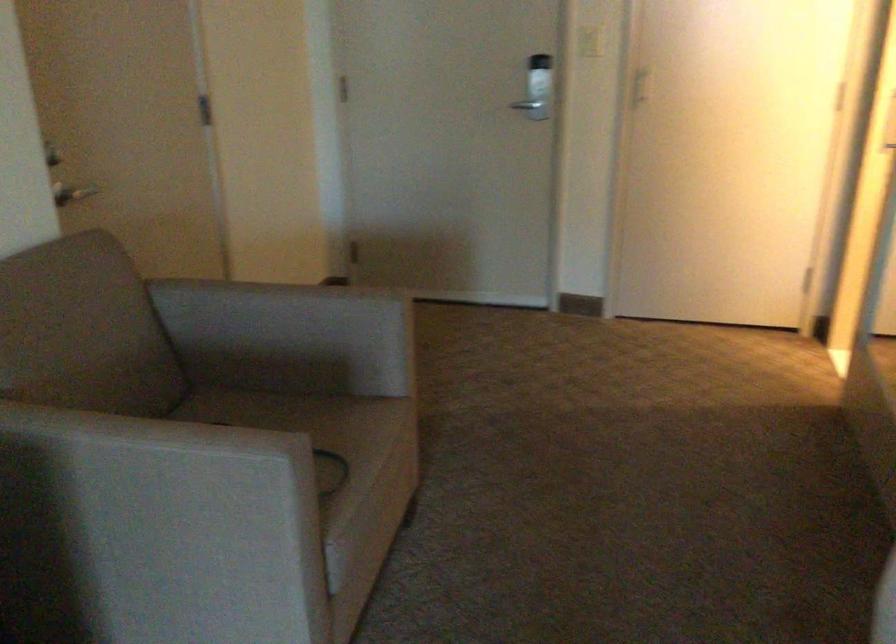
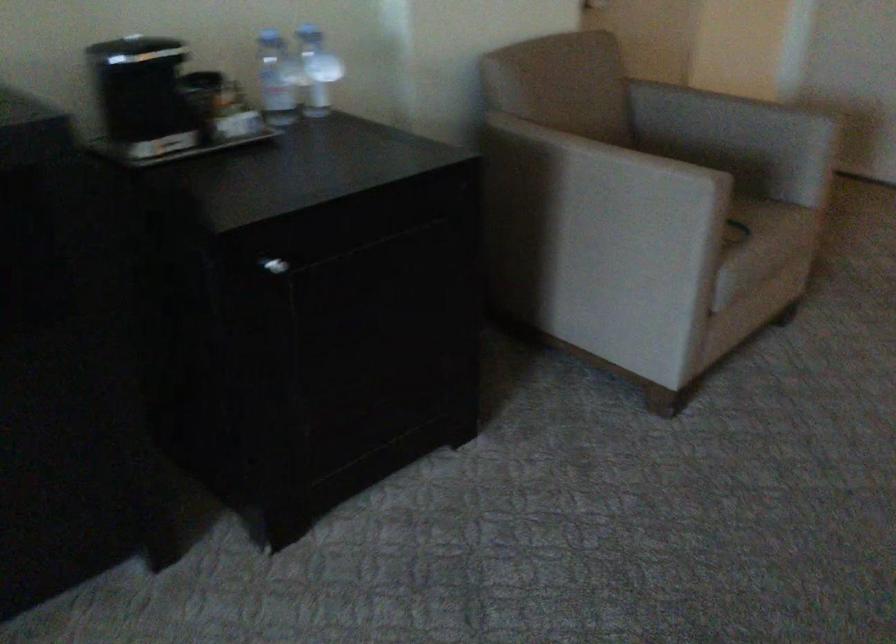
Question: The images are taken continuously from a first-person perspective. In which direction is your viewpoint rotating?

Choices:
 (A) Left
 (B) Right
 (C) Up
 (D) Down

Answer: (A)